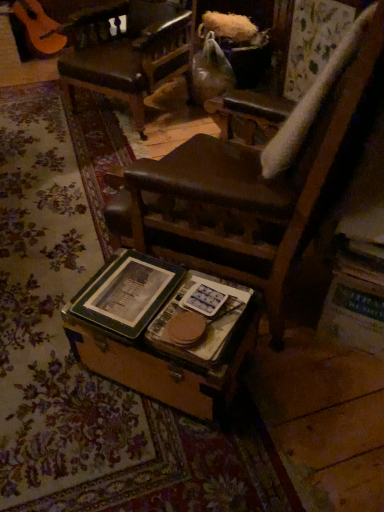
Find the location of a particular element. This screenshot has width=384, height=512. free spot above hardcover book at center, marked as the 2th paperback book in a left-to-right arrangement (from a real-world perspective) is located at coordinates (202, 309).